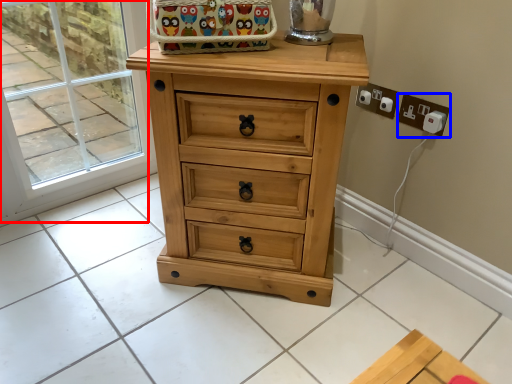
Question: Which object appears closest to the camera in this image, glass door (highlighted by a red box) or electric outlet (highlighted by a blue box)?

Choices:
 (A) glass door
 (B) electric outlet

Answer: (A)